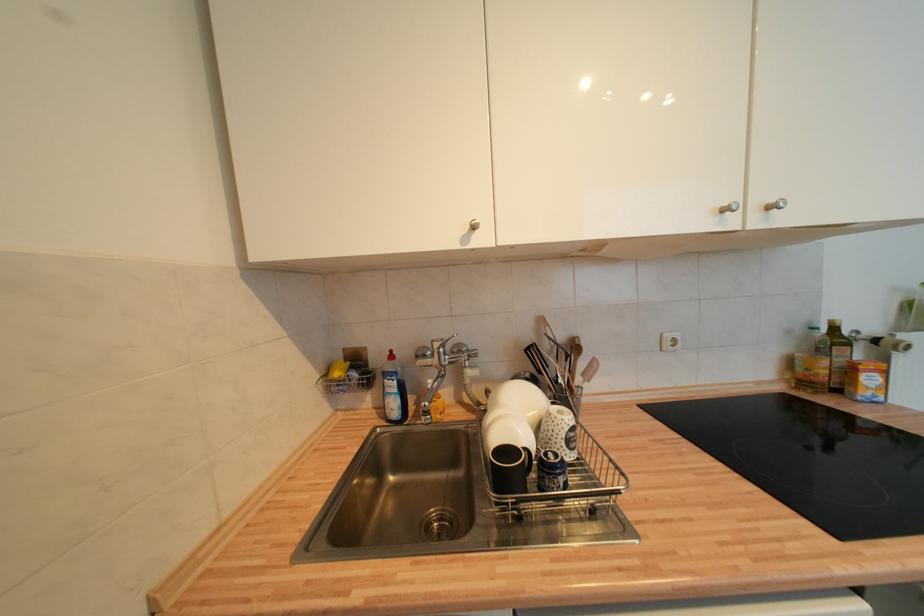
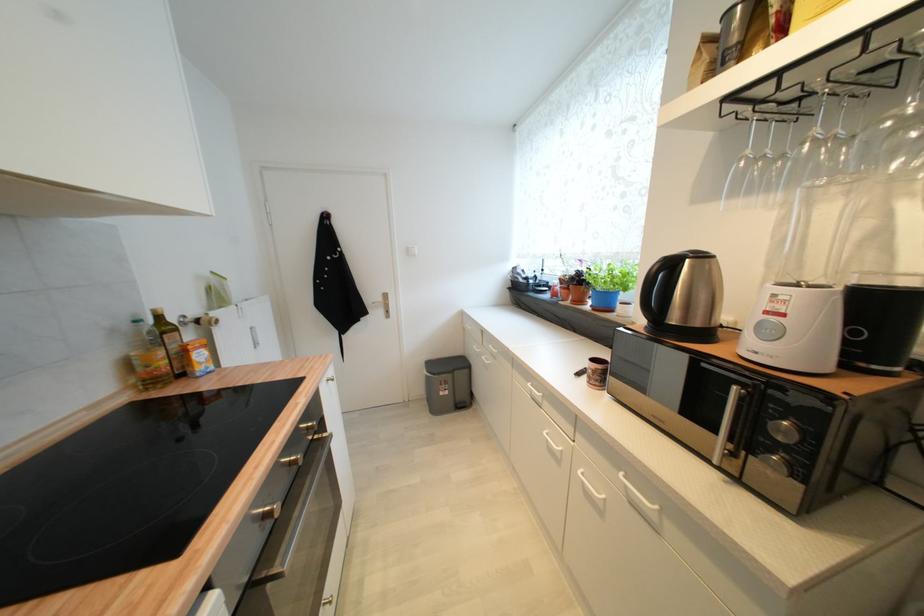
Question: The camera is either moving clockwise (left) or counter-clockwise (right) around the object. The first image is from the beginning of the video and the second image is from the end. Is the camera moving left or right when shooting the video?

Choices:
 (A) Left
 (B) Right

Answer: (A)